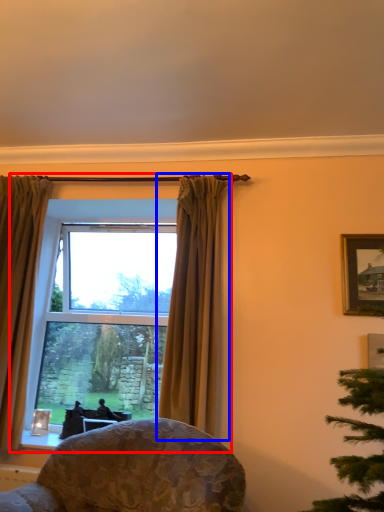
Question: Which point is further to the camera, window (highlighted by a red box) or curtain (highlighted by a blue box)?

Choices:
 (A) window
 (B) curtain

Answer: (A)